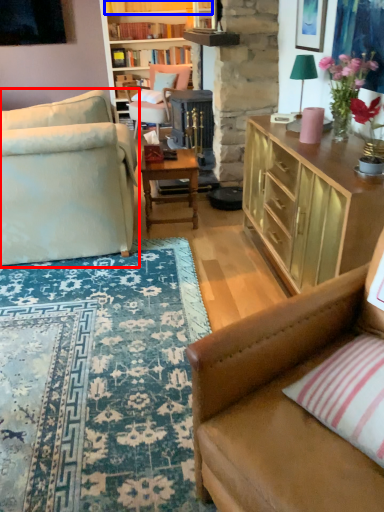
Question: Which object appears closest to the camera in this image, studio couch (highlighted by a red box) or book (highlighted by a blue box)?

Choices:
 (A) studio couch
 (B) book

Answer: (A)